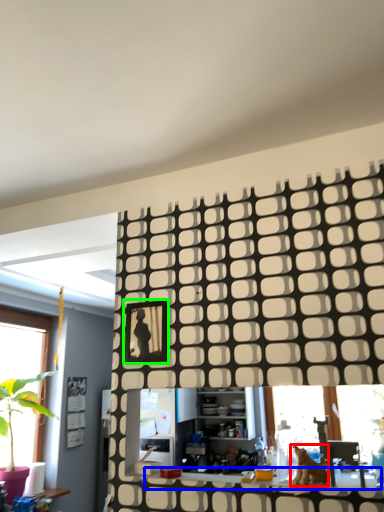
Question: Estimate the real-world distances between objects in this image. Which object is closer to animal (highlighted by a red box), counter top (highlighted by a blue box) or picture frame (highlighted by a green box)?

Choices:
 (A) counter top
 (B) picture frame

Answer: (A)